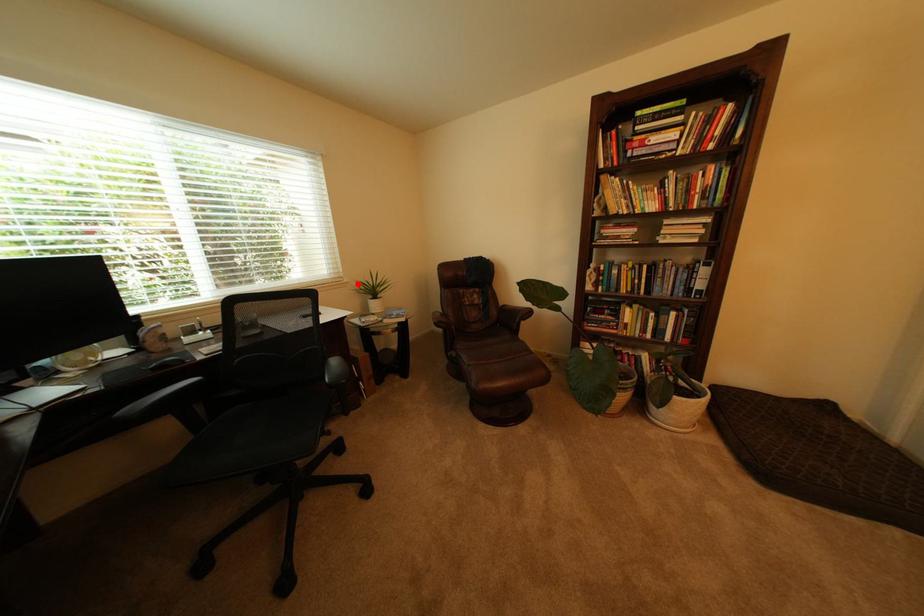
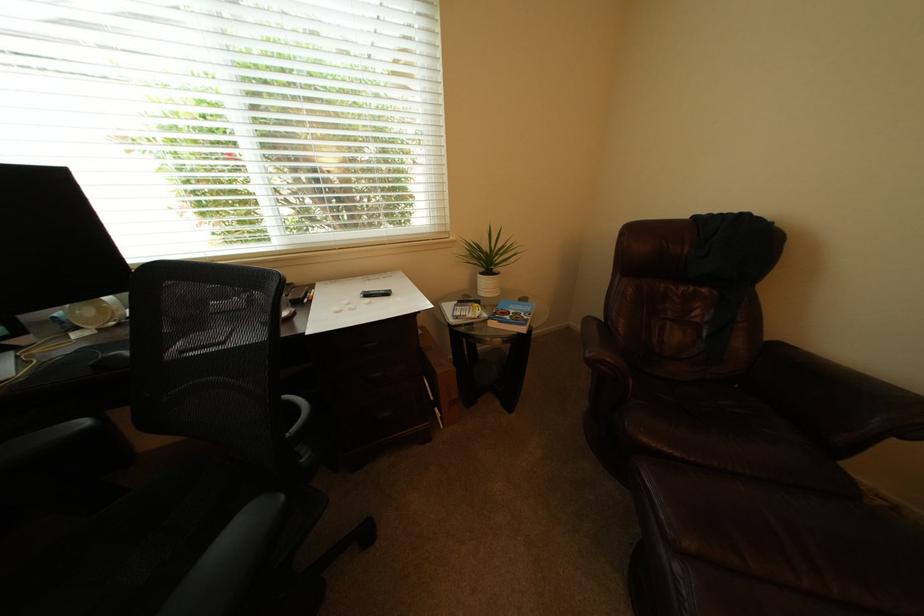
Where in the second image is the point corresponding to the highlighted location from the first image?

(466, 243)